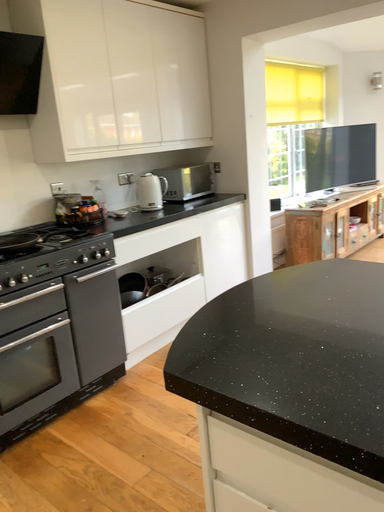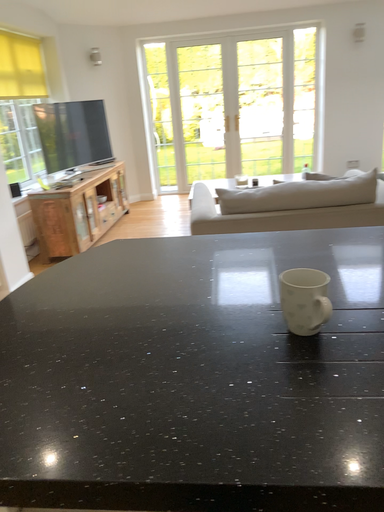
Question: How did the camera likely rotate when shooting the video?

Choices:
 (A) rotated right
 (B) rotated left

Answer: (A)